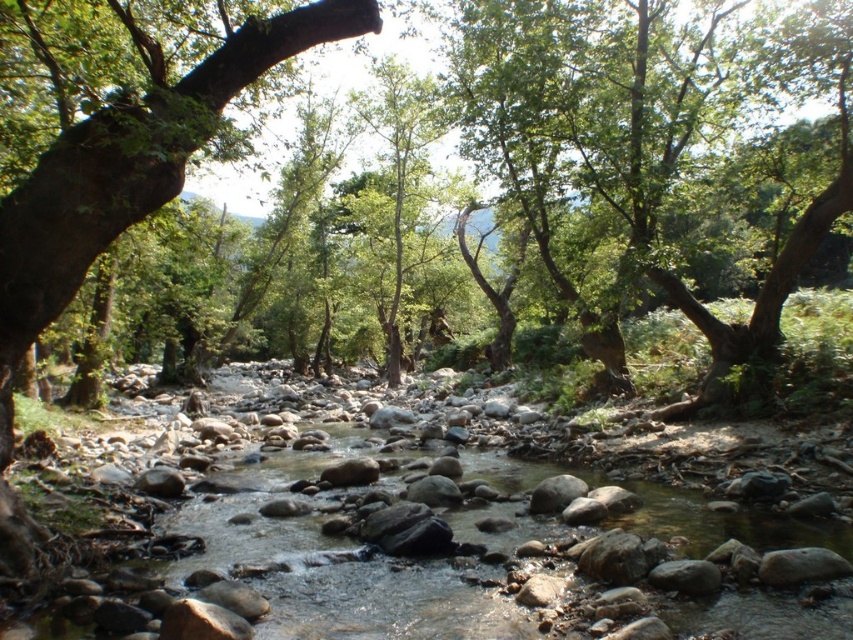
From the picture: Is green leafy tree at upper center below green rough bark tree at left?

Actually, green leafy tree at upper center is above green rough bark tree at left.

Does green leafy tree at upper center have a larger size compared to green rough bark tree at left?

Yes.

Who is more forward, (x=579, y=296) or (x=30, y=173)?

Point (x=30, y=173) is in front.

Locate an element on the screen. This screenshot has height=640, width=853. green leafy tree at upper center is located at coordinates (633, 144).